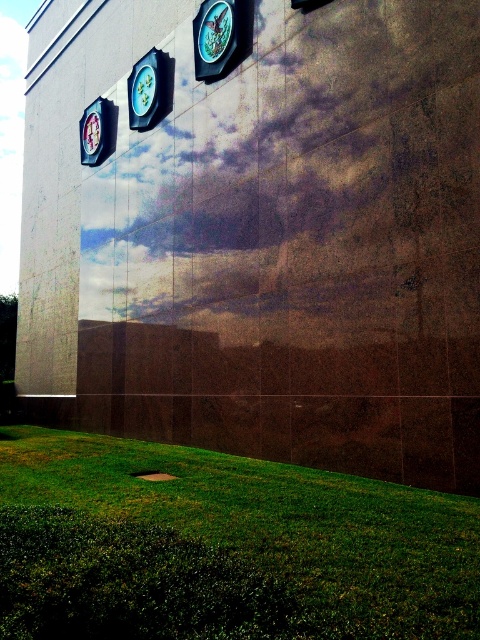
Is green grass at lower center to the right of metallic silver clock at upper center from the viewer's perspective?

Indeed, green grass at lower center is positioned on the right side of metallic silver clock at upper center.

Is green grass at lower center taller than metallic silver clock at upper center?

Incorrect, green grass at lower center's height is not larger of metallic silver clock at upper center's.

Is point (328, 544) closer to camera compared to point (228, 51)?

That is True.

Locate an element on the screen. green grass at lower center is located at coordinates tap(228, 545).

Which is behind, point (165, 488) or point (87, 163)?

The point (87, 163) is behind.

Between green grass at lower center and metallic blue clock at left, which one is positioned higher?

metallic blue clock at left is above.

Locate an element on the screen. This screenshot has height=640, width=480. green grass at lower center is located at coordinates (228, 545).

Is point (208, 76) closer to viewer compared to point (88, 164)?

Yes.

The height and width of the screenshot is (640, 480). What do you see at coordinates (216, 36) in the screenshot?
I see `metallic silver clock at upper center` at bounding box center [216, 36].

Locate an element on the screen. This screenshot has width=480, height=640. metallic silver clock at upper center is located at coordinates (216, 36).